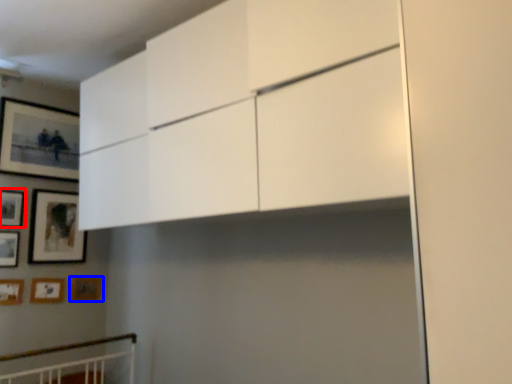
Question: Which of the following is the farthest to the observer, picture frame (highlighted by a red box) or picture frame (highlighted by a blue box)?

Choices:
 (A) picture frame
 (B) picture frame

Answer: (B)